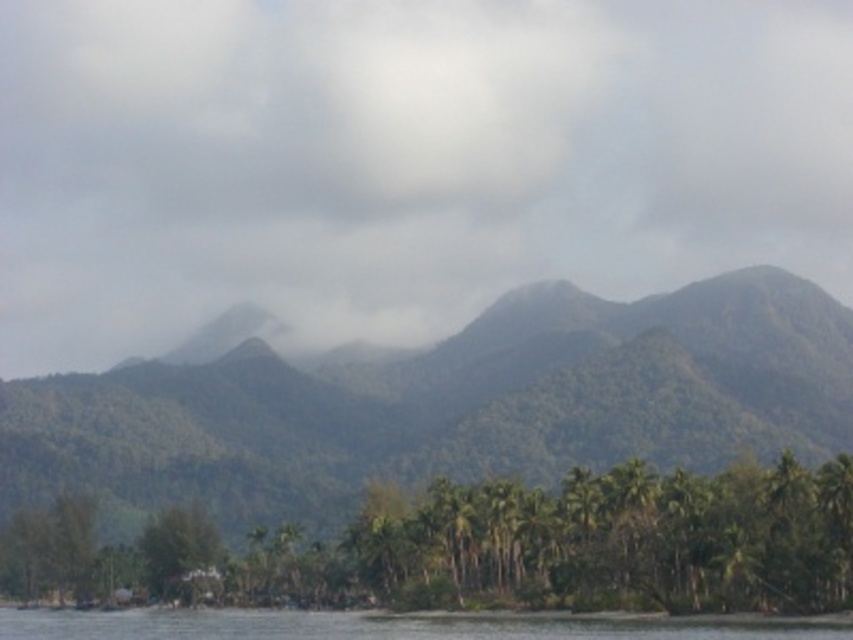
You are a hiker who wants to take a photo of the green leafy mountain at center and the green leafy trees at lower center in the same frame. Do you think you can stand at a distance where both are visible without moving your camera? Please explain your reasoning.

The green leafy mountain at center and green leafy trees at lower center are 293.25 feet apart. Since the distance between them is significant, you would need to position yourself far enough away so that both fit within your camera frame. However, without knowing the camera lens specifications or the desired framing, it is difficult to confirm definitively. Generally, a wide angle lens would be advisable to capture both elements in the same shot.